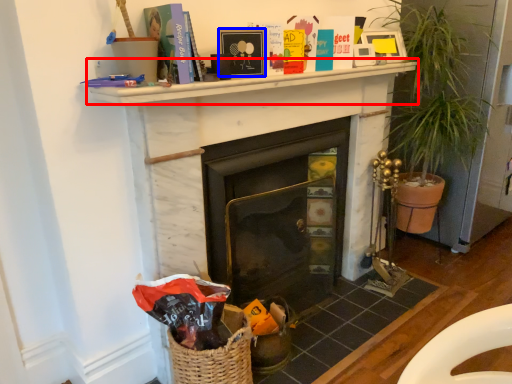
Question: Which of the following is the farthest to the observer, mantle (highlighted by a red box) or picture frame (highlighted by a blue box)?

Choices:
 (A) mantle
 (B) picture frame

Answer: (B)